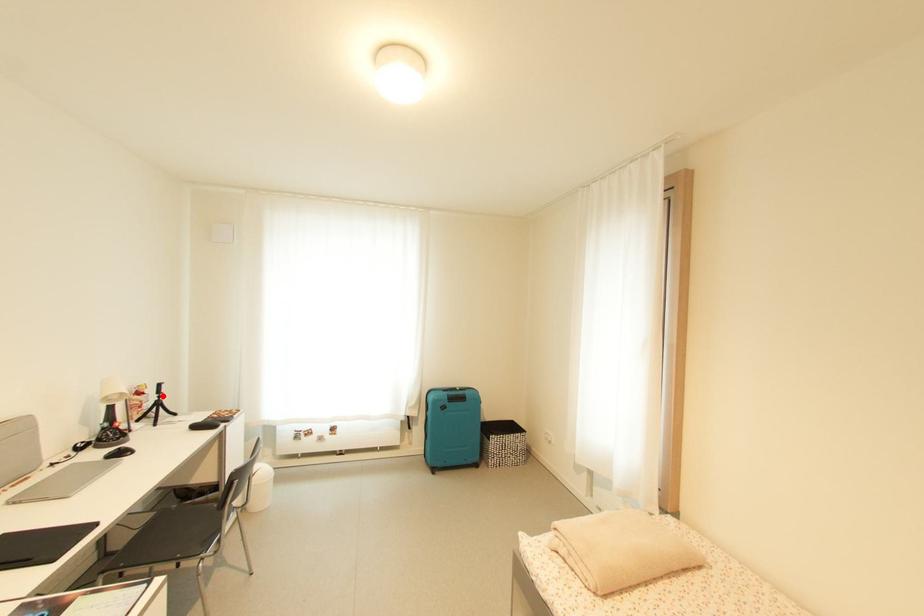
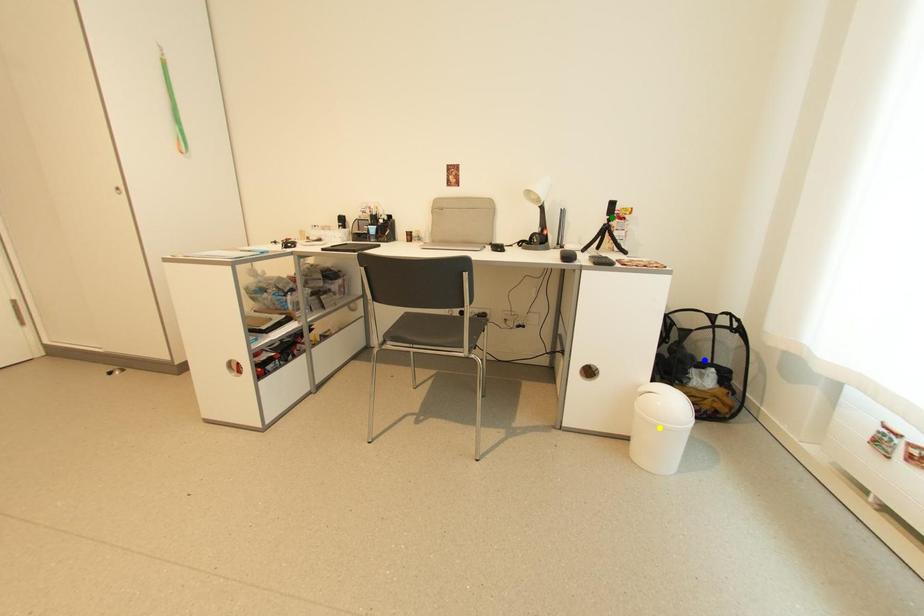
Question: I am providing you with two images of the same scene from different viewpoints. A red point is marked on the first image. You are given multiple points on the second image. Which point in image 2 is actually the same real-world point as the red point in image 1?

Choices:
 (A) blue point
 (B) green point
 (C) yellow point

Answer: (B)